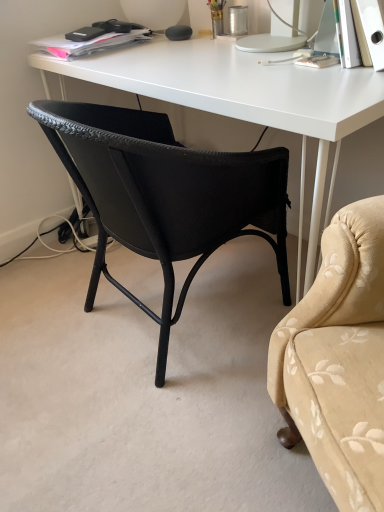
Where is `free space above black woven chair at center (from a real-world perspective)`? free space above black woven chair at center (from a real-world perspective) is located at coordinates (188, 73).